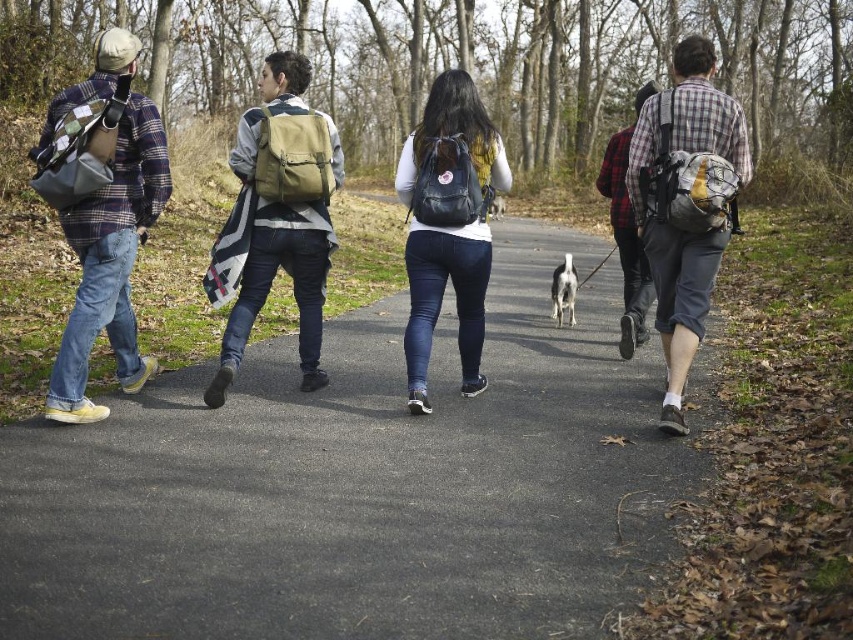
Question: Can you confirm if black matte backpack at center is wider than plaid flannel shirt at center-right?

Choices:
 (A) yes
 (B) no

Answer: (B)

Question: Is black backpack at center closer to the viewer compared to plaid flannel shirt at left?

Choices:
 (A) yes
 (B) no

Answer: (B)

Question: Which of the following is the farthest from the observer?

Choices:
 (A) (691, 280)
 (B) (302, 337)
 (C) (117, 128)
 (D) (479, 288)

Answer: (B)

Question: Which is nearer to the plaid flannel shirt at left?

Choices:
 (A) plaid flannel shirt at center
 (B) matte khaki backpack at center
 (C) black backpack at center
 (D) black matte backpack at center

Answer: (B)

Question: Does black backpack at center appear on the right side of matte khaki backpack at center?

Choices:
 (A) no
 (B) yes

Answer: (A)

Question: Which point appears closest to the camera in this image?

Choices:
 (A) pyautogui.click(x=727, y=209)
 (B) pyautogui.click(x=155, y=148)

Answer: (A)